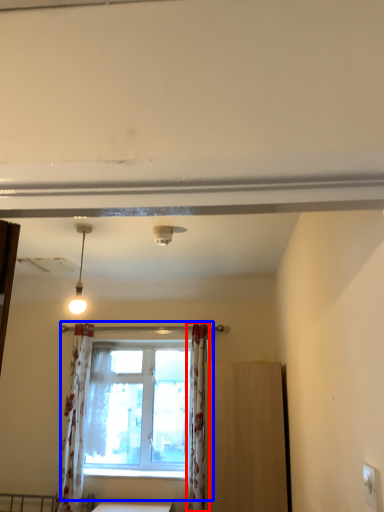
Question: Which point is further to the camera, curtain (highlighted by a red box) or window (highlighted by a blue box)?

Choices:
 (A) curtain
 (B) window

Answer: (B)